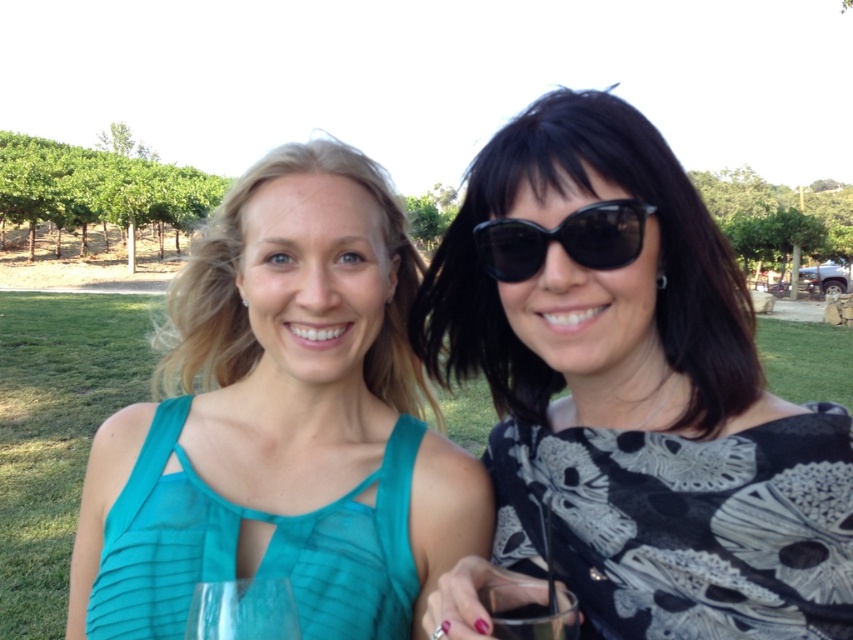
Question: Is black printed fabric dress at right to the left of clear plastic cup at center from the viewer's perspective?

Choices:
 (A) no
 (B) yes

Answer: (A)

Question: Estimate the real-world distances between objects in this image. Which object is closer to the clear plastic cup at center?

Choices:
 (A) teal sheer dress at left
 (B) transparent glass at center

Answer: (B)

Question: Can you confirm if black printed dress at center is positioned below black printed fabric dress at right?

Choices:
 (A) no
 (B) yes

Answer: (A)

Question: Does teal fabric dress at center appear under teal sheer dress at left?

Choices:
 (A) no
 (B) yes

Answer: (A)

Question: Which of the following is the closest to the observer?

Choices:
 (A) black printed dress at center
 (B) black printed fabric dress at right

Answer: (A)

Question: Estimate the real-world distances between objects in this image. Which object is closer to the black printed fabric dress at right?

Choices:
 (A) clear plastic cup at center
 (B) black printed dress at center
 (C) teal sheer dress at left
 (D) black plastic sunglasses at center

Answer: (B)